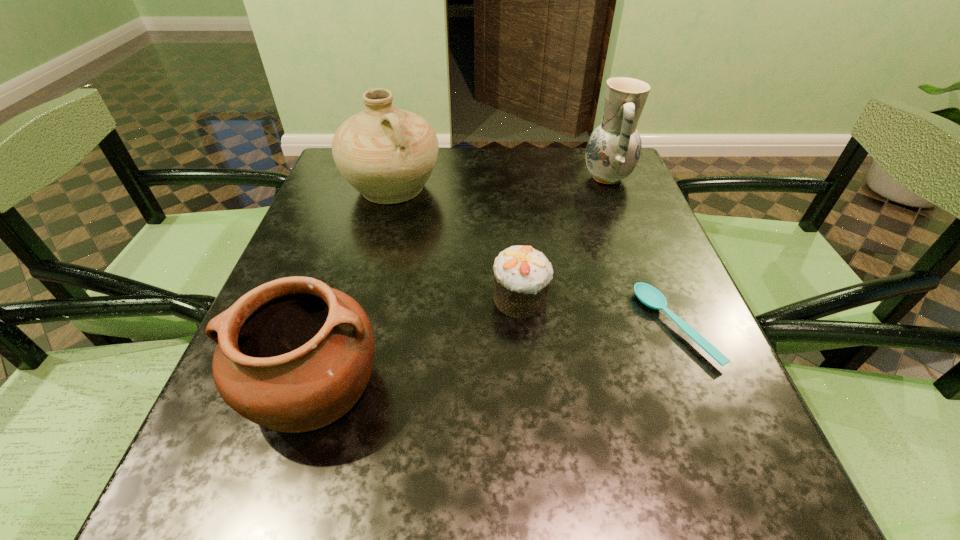
Find the location of a particular element. This screenshot has width=960, height=540. pottery that is the closest to the rightmost pottery is located at coordinates (387, 154).

In order to click on blank space that satisfies the following two spatial constraints: 1. on either side of the rightmost pottery; 2. on the back side of the spoon in this screenshot , I will do `click(664, 327)`.

Locate an element on the screen. This screenshot has width=960, height=540. vacant space that satisfies the following two spatial constraints: 1. on either side of the shortest object; 2. on the right side of the rightmost pottery is located at coordinates (664, 327).